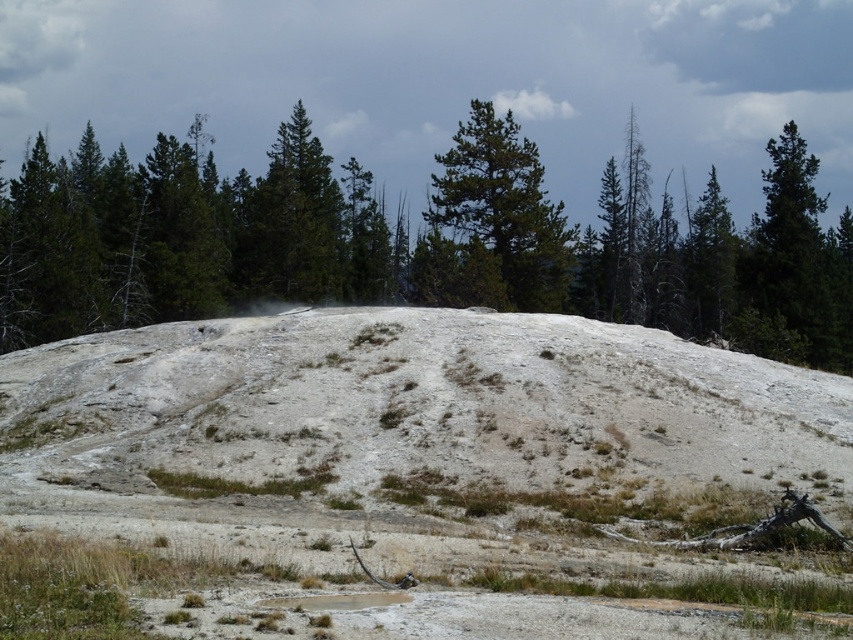
Question: Among these objects, which one is nearest to the camera?

Choices:
 (A) green textured tree at center
 (B) green matte tree at center

Answer: (A)

Question: Which point is farther from the camera taking this photo?

Choices:
 (A) (537, 202)
 (B) (495, 296)

Answer: (A)

Question: Can you confirm if green textured tree at center is positioned to the left of green matte tree at center?

Choices:
 (A) yes
 (B) no

Answer: (A)

Question: Is green textured tree at center below green matte tree at center?

Choices:
 (A) no
 (B) yes

Answer: (A)

Question: Which point is farther to the camera?

Choices:
 (A) green matte tree at center
 (B) green textured tree at center

Answer: (A)

Question: Is green textured tree at center behind green matte tree at center?

Choices:
 (A) yes
 (B) no

Answer: (B)